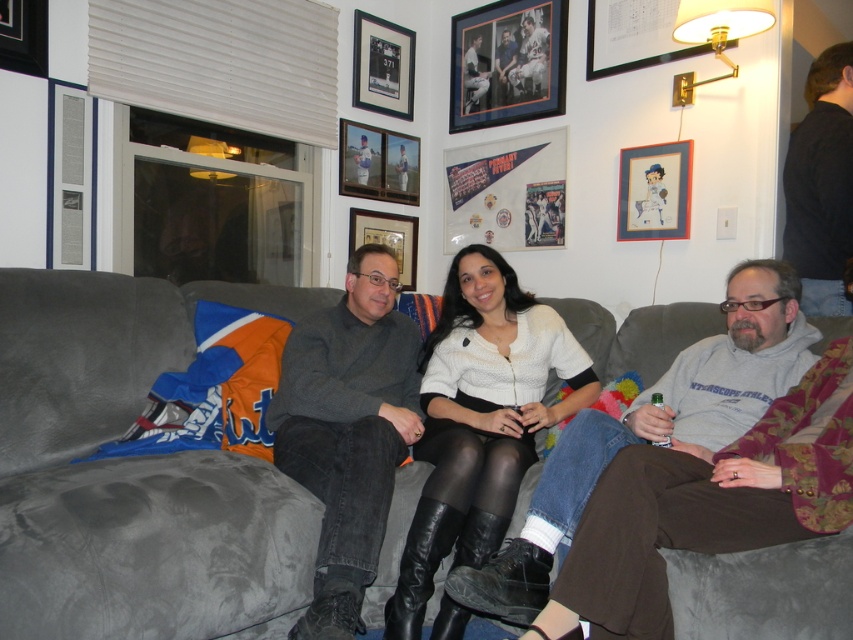
Does wooden framed picture at upper center have a larger size compared to wooden betty boop portrait at upper right?

Yes.

The height and width of the screenshot is (640, 853). I want to click on wooden framed picture at upper center, so click(508, 61).

Who is more distant from viewer, (502,524) or (410,285)?

The point (410,285) is behind.

The image size is (853, 640). Identify the location of white matte sweater at center. (480, 420).

Between dark gray sweater at center and black fabric shirt at upper right, which one has more height?

With more height is black fabric shirt at upper right.

How much distance is there between dark gray sweater at center and black fabric shirt at upper right?

dark gray sweater at center is 1.37 meters away from black fabric shirt at upper right.

Is point (357, 253) farther from viewer compared to point (793, 220)?

No, (357, 253) is closer to viewer.

Where is `dark gray sweater at center`? This screenshot has height=640, width=853. dark gray sweater at center is located at coordinates pos(347,429).